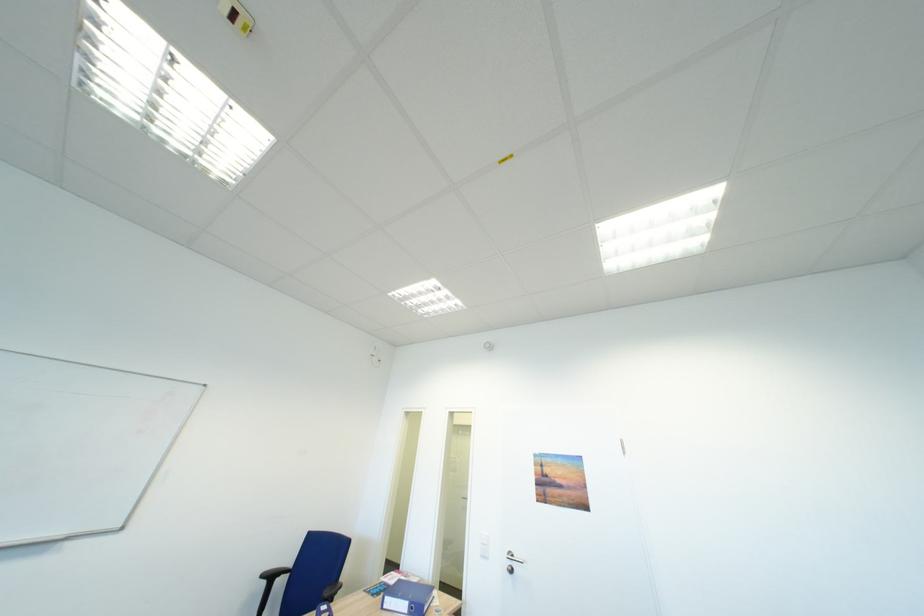
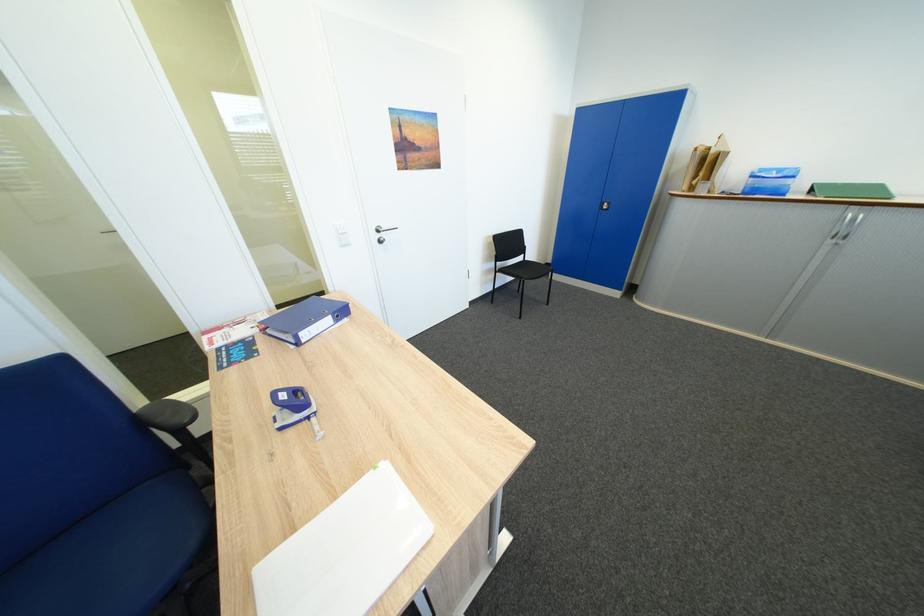
Find the pixel in the second image that matches (x=524, y=557) in the first image.

(392, 229)